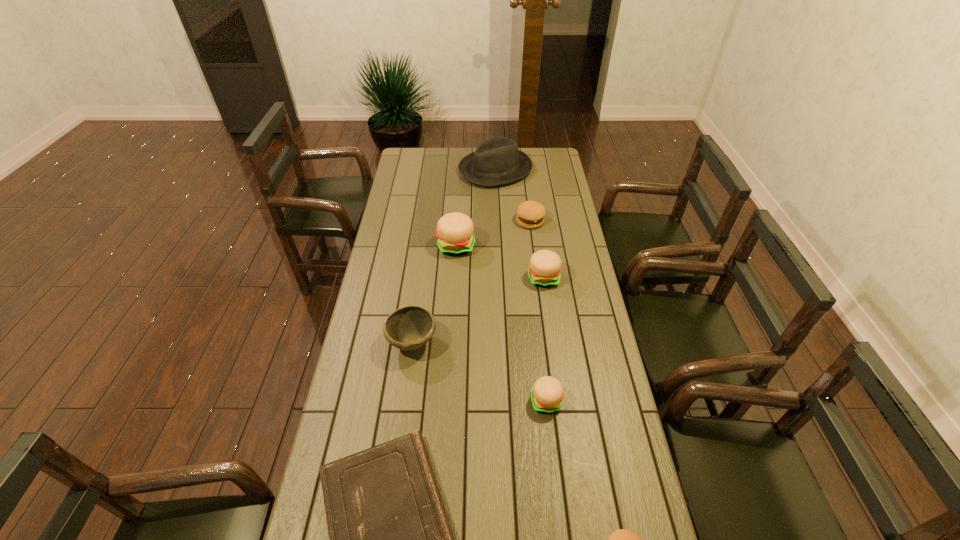
Identify the location of object present at the far right corner. (496, 161).

Identify the location of vacant space at the far edge of the desktop. (448, 160).

Where is `vacant space at the left edge of the desktop`? Image resolution: width=960 pixels, height=540 pixels. vacant space at the left edge of the desktop is located at coordinates (401, 278).

Image resolution: width=960 pixels, height=540 pixels. Identify the location of blank space at the right edge of the desktop. (548, 232).

Image resolution: width=960 pixels, height=540 pixels. Find the location of `blank region between the bowl and the gray fedora`. blank region between the bowl and the gray fedora is located at coordinates (454, 256).

Identify the location of unoccupied area between the bowl and the third nearest object. (479, 372).

Find the location of a particular element. free space that is in between the farthest hamburger and the third farthest hamburger is located at coordinates (537, 249).

Locate an element on the screen. free spot between the farthest object and the nearest beige hamburger is located at coordinates (520, 286).

Locate an element on the screen. This screenshot has width=960, height=540. free area in between the second biggest beige hamburger and the farthest hamburger is located at coordinates (537, 249).

Locate an element on the screen. Image resolution: width=960 pixels, height=540 pixels. blank region between the leftmost beige hamburger and the second farthest beige hamburger is located at coordinates (500, 262).